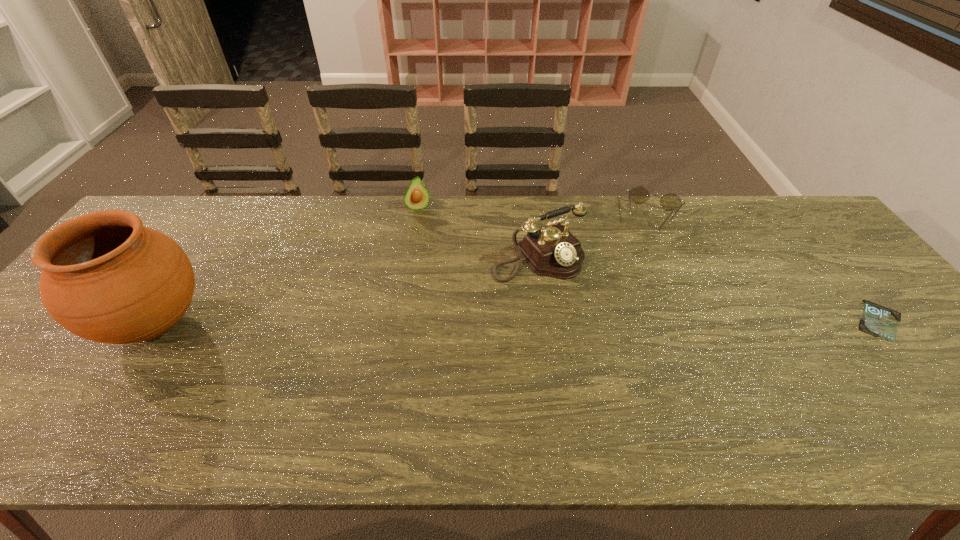
Where is `vacant space on the desktop that is between the pottery and the shortest object and is positioned on the cut side of the third tallest object`? This screenshot has height=540, width=960. vacant space on the desktop that is between the pottery and the shortest object and is positioned on the cut side of the third tallest object is located at coordinates (458, 322).

This screenshot has width=960, height=540. What are the coordinates of `vacant spot on the desktop that is between the pottery and the identity card and is positioned on the dial of the third object from right to left` in the screenshot? It's located at (597, 321).

Where is `free spot on the desktop that is between the leftmost object and the rightmost object and is positioned on the front-facing side of the fourth tallest object`? free spot on the desktop that is between the leftmost object and the rightmost object and is positioned on the front-facing side of the fourth tallest object is located at coordinates (626, 321).